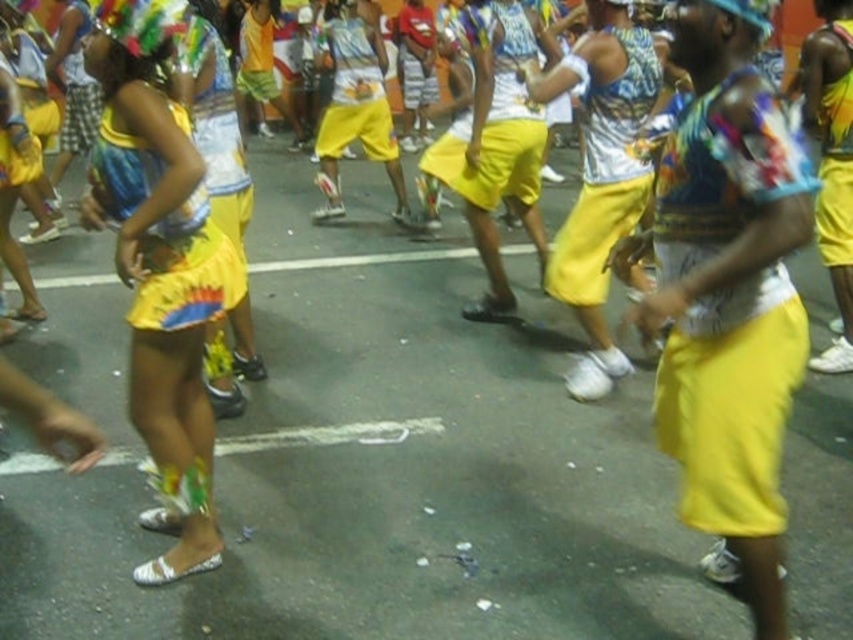
Question: Which point appears closest to the camera in this image?

Choices:
 (A) (607, 150)
 (B) (822, 92)
 (C) (242, 294)

Answer: (C)

Question: Which object is farther from the camera taking this photo?

Choices:
 (A) shiny metallic skirt at left
 (B) matte yellow shorts at center
 (C) matte yellow shorts at right
 (D) shiny metallic shorts at right

Answer: (D)

Question: Is shiny metallic skirt at left smaller than matte yellow shorts at center?

Choices:
 (A) no
 (B) yes

Answer: (A)

Question: Among these points, which one is nearest to the camera?

Choices:
 (A) coord(846,237)
 (B) coord(219,237)

Answer: (B)

Question: Does shiny metallic skirt at left appear on the right side of matte yellow skirt at center?

Choices:
 (A) yes
 (B) no

Answer: (A)

Question: Can you confirm if matte yellow skirt at center is wider than matte yellow shorts at center?

Choices:
 (A) yes
 (B) no

Answer: (B)